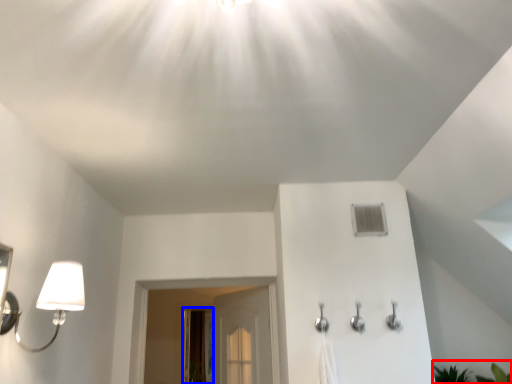
Question: Which object appears closest to the camera in this image, plant (highlighted by a red box) or screen door (highlighted by a blue box)?

Choices:
 (A) plant
 (B) screen door

Answer: (A)